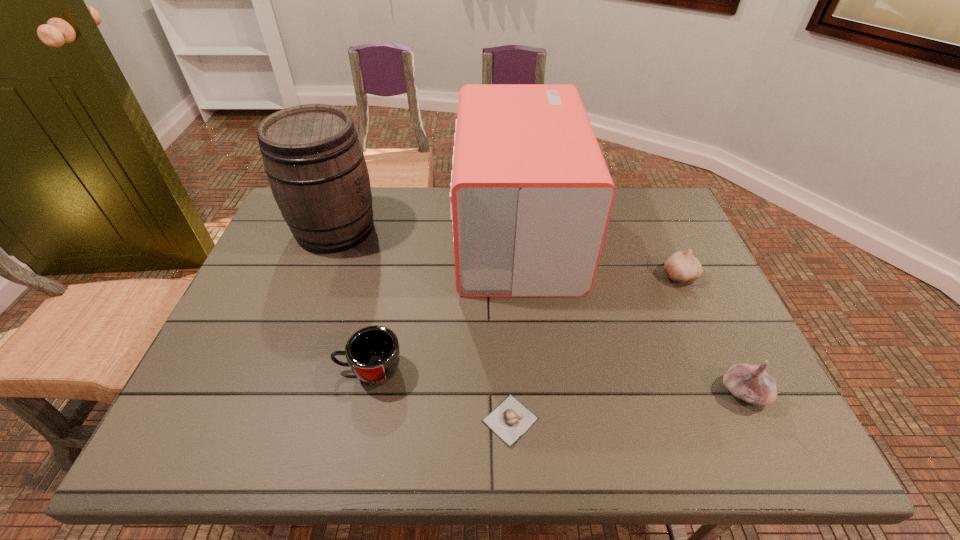
At what (x,y) coordinates should I click in order to perform the action: click on free space located on the front of the wine bucket. Please return your answer as a coordinate pair (x, y). This screenshot has height=540, width=960. Looking at the image, I should click on (312, 292).

Locate an element on the screen. The image size is (960, 540). vacant space located on the left of the tallest garlic is located at coordinates (660, 393).

Locate an element on the screen. The height and width of the screenshot is (540, 960). vacant region located 0.330m on the front of the farthest garlic is located at coordinates pos(735,401).

I want to click on vacant space located 0.190m on the side of the mug with the handle, so click(252, 370).

At what (x,y) coordinates should I click in order to perform the action: click on vacant region located on the side of the mug with the handle. Please return your answer as a coordinate pair (x, y). The height and width of the screenshot is (540, 960). Looking at the image, I should click on (304, 370).

I want to click on vacant area located 0.130m on the side of the mug with the handle, so click(x=277, y=370).

At what (x,y) coordinates should I click in order to perform the action: click on vacant space located on the right of the shortest object. Please return your answer as a coordinate pair (x, y). Looking at the image, I should click on click(x=729, y=420).

Locate an element on the screen. The width and height of the screenshot is (960, 540). box that is at the far edge is located at coordinates (531, 196).

The image size is (960, 540). I want to click on wine bucket present at the far edge, so [315, 164].

Identify the location of object at the near edge. The height and width of the screenshot is (540, 960). (510, 420).